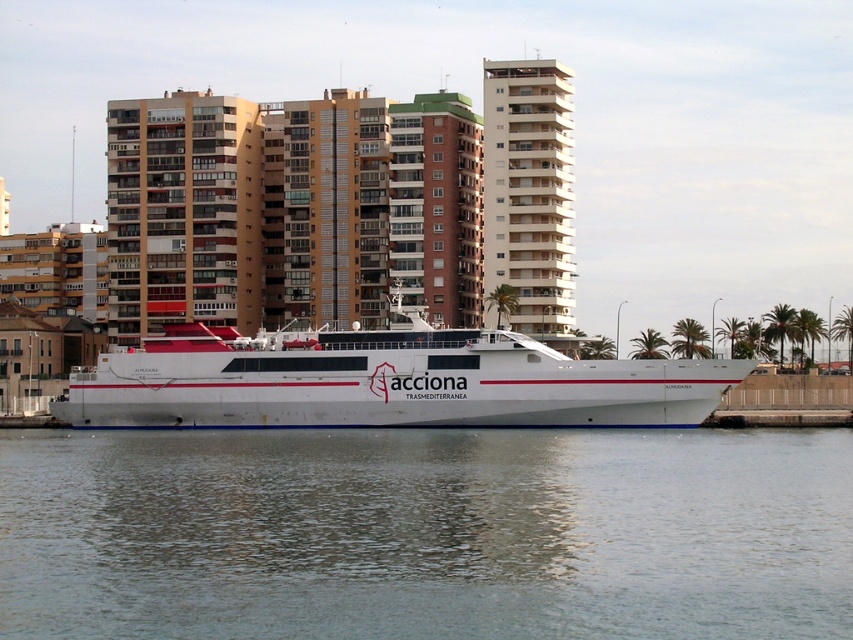
You are standing on the ferry and want to walk towards the residential buildings in the background. Which point, point (235,500) or point (231,356), is closer to you?

Point (235,500) is in front of point (231,356), so it is closer to you.

You are standing on the dock and see the clear water at lower center and the white matte ship at center. Which object is wider from your perspective?

The clear water at lower center might be wider than white matte ship at center according to the description.

You are standing on the dock and looking out at the scene. Which object is closer to you between the clear water at lower center and the white matte ship at center?

The clear water at lower center is closer to you because it is in front of the white matte ship at center.